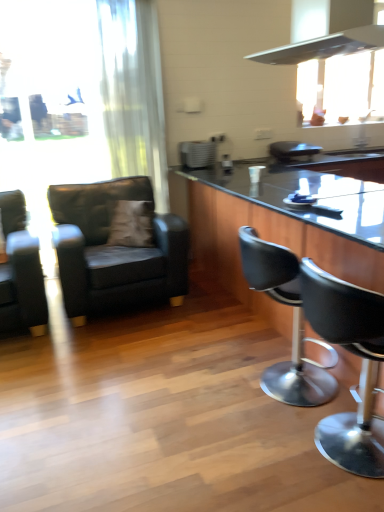
Identify the location of vacant space to the left of black leather bar stool at center, the third chair from the left. (194, 393).